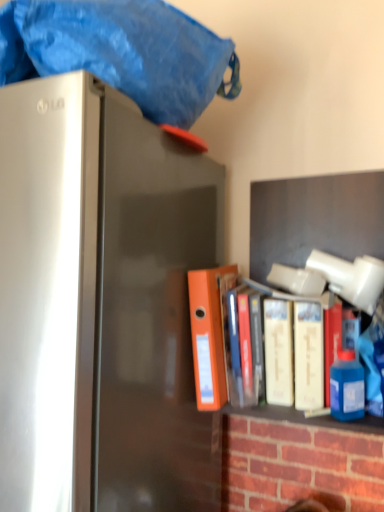
Describe the element at coordinates (208, 336) in the screenshot. The image size is (384, 512). I see `orange matte folder at center, which is counted as the first book, starting from the left` at that location.

In order to face satin silver refrigerator at left, should I rotate leftwards or rightwards?

Rotate your view left by about 16.644°.

Find the location of a particular element. The image size is (384, 512). blue plastic bottle at right is located at coordinates (347, 385).

Locate an element on the screen. The width and height of the screenshot is (384, 512). orange matte folder at center, which is the 2th book in right-to-left order is located at coordinates (208, 336).

Is point (363, 374) closer to camera compared to point (180, 41)?

No, it is behind (180, 41).

Is blue plastic bottle at right situated inside blue fabric at top or outside?

blue plastic bottle at right is not enclosed by blue fabric at top.

From the image's perspective, is blue plastic bottle at right below blue fabric at top?

Yes, from the image's perspective, blue plastic bottle at right is beneath blue fabric at top.

Can you tell me how much blue plastic bottle at right and blue fabric at top differ in facing direction?

The facing directions of blue plastic bottle at right and blue fabric at top are 45 degrees apart.

Considering the relative sizes of blue fabric at top and blue plastic bottle at right in the image provided, is blue fabric at top wider than blue plastic bottle at right?

Indeed, blue fabric at top has a greater width compared to blue plastic bottle at right.

Is blue fabric at top not near blue plastic bottle at right?

blue fabric at top is actually quite close to blue plastic bottle at right.

Considering the points (11, 27) and (346, 383), which point is in front, point (11, 27) or point (346, 383)?

Point (11, 27)

Is satin silver refrigerator at left not near orange matte folder at center, which is the 2th book in right-to-left order?

They are positioned close to each other.

Can you tell me how much satin silver refrigerator at left and orange matte folder at center, which is the 2th book in right-to-left order, differ in facing direction?

0.000135 degrees.

Is satin silver refrigerator at left inside or outside of orange matte folder at center, which is counted as the first book, starting from the left?

The correct answer is: outside.

In terms of width, does blue plastic bottle at right look wider or thinner when compared to satin silver refrigerator at left?

Clearly, blue plastic bottle at right has less width compared to satin silver refrigerator at left.

Can you tell me how much blue plastic bottle at right and satin silver refrigerator at left differ in facing direction?

The facing directions of blue plastic bottle at right and satin silver refrigerator at left are 44.1 degrees apart.

From the image's perspective, who appears lower, blue plastic bottle at right or satin silver refrigerator at left?

satin silver refrigerator at left.

Is satin silver refrigerator at left at the back of blue plastic bottle at right?

No, blue plastic bottle at right is not facing the opposite direction of satin silver refrigerator at left.

Considering the sizes of objects orange matte folder at center, which is the 2th book in right-to-left order, and blue fabric at top in the image provided, who is smaller, orange matte folder at center, which is the 2th book in right-to-left order, or blue fabric at top?

orange matte folder at center, which is the 2th book in right-to-left order.

From the image's perspective, which is above, orange matte folder at center, which is counted as the first book, starting from the left, or blue fabric at top?

From the image's view, blue fabric at top is above.

Which is behind, point (199, 368) or point (156, 90)?

Positioned behind is point (199, 368).

Is orange matte folder at center, which is counted as the first book, starting from the left, turned away from blue fabric at top?

orange matte folder at center, which is counted as the first book, starting from the left, is not turned away from blue fabric at top.

Looking at this image, would you consider blue plastic bottle at right to be distant from white matte book at center, which is counted as the second book, starting from the left?

blue plastic bottle at right is actually quite close to white matte book at center, which is counted as the second book, starting from the left.

What's the angular difference between blue plastic bottle at right and white matte book at center, which is counted as the second book, starting from the left,'s facing directions?

blue plastic bottle at right and white matte book at center, which is counted as the second book, starting from the left, are facing 44.1 degrees away from each other.

Which of these two, blue plastic bottle at right or white matte book at center, the 1th book viewed from the right, is thinner?

blue plastic bottle at right.

Can you confirm if satin silver refrigerator at left is bigger than blue fabric at top?

Indeed, satin silver refrigerator at left has a larger size compared to blue fabric at top.

Is satin silver refrigerator at left taller than blue fabric at top?

Correct, satin silver refrigerator at left is much taller as blue fabric at top.

Can you confirm if satin silver refrigerator at left is positioned to the right of blue fabric at top?

No.

Is blue fabric at top surrounded by satin silver refrigerator at left?

No, blue fabric at top is not inside satin silver refrigerator at left.

At what (x,y) coordinates should I click in order to perform the action: click on bottle below the blue fabric at top (from a real-world perspective). Please return your answer as a coordinate pair (x, y). Looking at the image, I should click on (347, 385).

Where is `blanket above the blue plastic bottle at right (from the image's perspective)`? Image resolution: width=384 pixels, height=512 pixels. blanket above the blue plastic bottle at right (from the image's perspective) is located at coordinates [x=121, y=52].

Considering their positions, is blue plastic bottle at right positioned closer to satin silver refrigerator at left than white matte book at center, the 1th book viewed from the right?

Among the two, white matte book at center, the 1th book viewed from the right, is located nearer to satin silver refrigerator at left.

Looking at the image, which one is located closer to white matte book at center, the 1th book viewed from the right, blue fabric at top or blue plastic bottle at right?

Based on the image, blue plastic bottle at right appears to be nearer to white matte book at center, the 1th book viewed from the right.

From the image, which object appears to be farther from satin silver refrigerator at left, blue fabric at top or white matte book at center, the 1th book viewed from the right?

blue fabric at top.

Based on their spatial positions, is blue fabric at top or satin silver refrigerator at left closer to blue plastic bottle at right?

The object closer to blue plastic bottle at right is satin silver refrigerator at left.

Which object lies further to the anchor point orange matte folder at center, which is the 2th book in right-to-left order, blue plastic bottle at right or white matte book at center, which is counted as the second book, starting from the left?

blue plastic bottle at right lies further to orange matte folder at center, which is the 2th book in right-to-left order, than the other object.

When comparing their distances from satin silver refrigerator at left, does white matte book at center, which is counted as the second book, starting from the left, or blue plastic bottle at right seem further?

blue plastic bottle at right.

From the image, which object appears to be farther from blue plastic bottle at right, orange matte folder at center, which is the 2th book in right-to-left order, or white matte book at center, the 1th book viewed from the right?

Among the two, orange matte folder at center, which is the 2th book in right-to-left order, is located further to blue plastic bottle at right.

Estimate the real-world distances between objects in this image. Which object is closer to orange matte folder at center, which is the 2th book in right-to-left order, white matte book at center, which is counted as the second book, starting from the left, or blue plastic bottle at right?

Among the two, white matte book at center, which is counted as the second book, starting from the left, is located nearer to orange matte folder at center, which is the 2th book in right-to-left order.

Image resolution: width=384 pixels, height=512 pixels. Identify the location of book located between satin silver refrigerator at left and white matte book at center, which is counted as the second book, starting from the left, in the left-right direction. (208, 336).

I want to click on book between orange matte folder at center, which is counted as the first book, starting from the left, and blue plastic bottle at right, so click(x=217, y=342).

Where is `book between blue fabric at top and white matte book at center, which is counted as the second book, starting from the left, vertically`? The width and height of the screenshot is (384, 512). book between blue fabric at top and white matte book at center, which is counted as the second book, starting from the left, vertically is located at coordinates (208, 336).

Where is `bottle between blue fabric at top and satin silver refrigerator at left in the up-down direction`? Image resolution: width=384 pixels, height=512 pixels. bottle between blue fabric at top and satin silver refrigerator at left in the up-down direction is located at coordinates (347, 385).